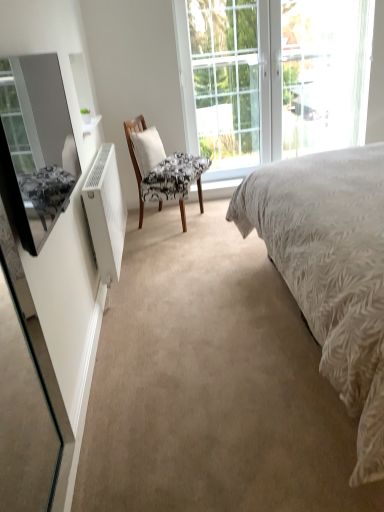
Question: Considering the relative positions of clear glass window at upper center and patterned fabric chair at center in the image provided, is clear glass window at upper center to the left of patterned fabric chair at center from the viewer's perspective?

Choices:
 (A) no
 (B) yes

Answer: (A)

Question: Is clear glass window at upper center next to patterned fabric chair at center and touching it?

Choices:
 (A) yes
 (B) no

Answer: (B)

Question: Is clear glass window at upper center far away from patterned fabric chair at center?

Choices:
 (A) no
 (B) yes

Answer: (A)

Question: From the image's perspective, is clear glass window at upper center located above patterned fabric chair at center?

Choices:
 (A) yes
 (B) no

Answer: (A)

Question: Is clear glass window at upper center facing towards patterned fabric chair at center?

Choices:
 (A) yes
 (B) no

Answer: (B)

Question: Is clear glass window at upper center wider than patterned fabric chair at center?

Choices:
 (A) no
 (B) yes

Answer: (A)

Question: Is patterned fabric chair at center thinner than clear glass door at center?

Choices:
 (A) yes
 (B) no

Answer: (B)

Question: From a real-world perspective, is patterned fabric chair at center positioned under clear glass door at center based on gravity?

Choices:
 (A) yes
 (B) no

Answer: (A)

Question: Can clear glass door at center be found inside patterned fabric chair at center?

Choices:
 (A) no
 (B) yes

Answer: (A)

Question: Is patterned fabric chair at center bigger than clear glass door at center?

Choices:
 (A) no
 (B) yes

Answer: (A)

Question: Is patterned fabric chair at center facing towards clear glass door at center?

Choices:
 (A) no
 (B) yes

Answer: (A)

Question: Does patterned fabric chair at center have a greater height compared to clear glass door at center?

Choices:
 (A) no
 (B) yes

Answer: (A)

Question: Does matte black mirror at left have a larger size compared to white textured bed at center?

Choices:
 (A) no
 (B) yes

Answer: (A)